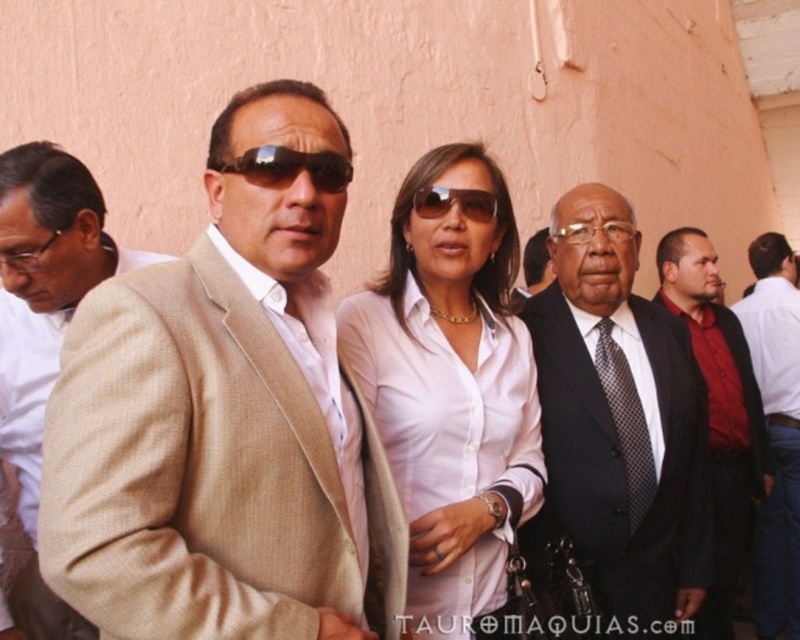
Who is positioned more to the left, dark blue suit at center or sunglasses at center?

From the viewer's perspective, sunglasses at center appears more on the left side.

Is dark blue suit at center bigger than sunglasses at center?

Yes.

Does point (613, 499) come behind point (433, 186)?

Yes, it is.

This screenshot has height=640, width=800. Find the location of `dark blue suit at center`. dark blue suit at center is located at coordinates (622, 435).

Between point (402, 275) and point (684, 298), which one is positioned in front?

Point (402, 275) is more forward.

Is white satin blouse at center to the left of dark red shirt at center from the viewer's perspective?

Correct, you'll find white satin blouse at center to the left of dark red shirt at center.

Between point (468, 401) and point (758, 451), which one is positioned behind?

The point (758, 451) is more distant.

What are the coordinates of `white satin blouse at center` in the screenshot? It's located at (450, 390).

Which is more to the left, dark blue suit at center or transparent plastic glasses at center?

transparent plastic glasses at center

In the scene shown: Does dark blue suit at center appear over transparent plastic glasses at center?

Actually, dark blue suit at center is below transparent plastic glasses at center.

This screenshot has height=640, width=800. I want to click on dark blue suit at center, so click(x=622, y=435).

The width and height of the screenshot is (800, 640). In order to click on dark blue suit at center in this screenshot , I will do `click(622, 435)`.